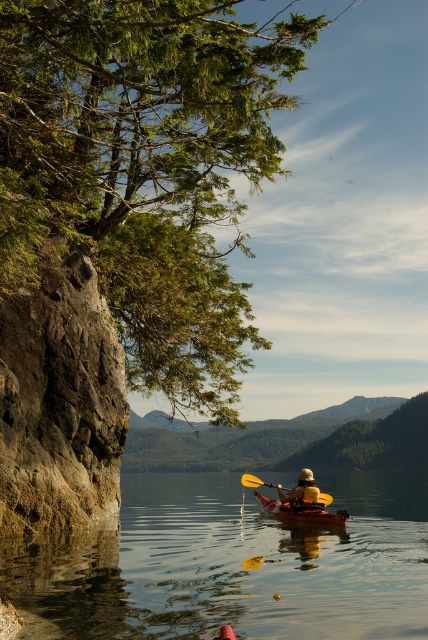
Question: Estimate the real-world distances between objects in this image. Which object is closer to the clear water at center?

Choices:
 (A) yellow plastic paddle at center
 (B) orange plastic kayak at center
 (C) yellow foam kayak at center

Answer: (A)

Question: Does clear water at center appear on the right side of orange plastic kayak at center?

Choices:
 (A) no
 (B) yes

Answer: (B)

Question: Among these points, which one is farthest from the camera?

Choices:
 (A) 278,486
 (B) 275,499
 (C) 246,481
 (D) 112,556

Answer: (C)

Question: Which point is closer to the camera?

Choices:
 (A) (249, 474)
 (B) (278, 492)

Answer: (B)

Question: Does yellow foam kayak at center come behind yellow plastic paddle at center?

Choices:
 (A) yes
 (B) no

Answer: (B)

Question: Where is clear water at center located in relation to yellow foam kayak at center in the image?

Choices:
 (A) left
 (B) right

Answer: (B)